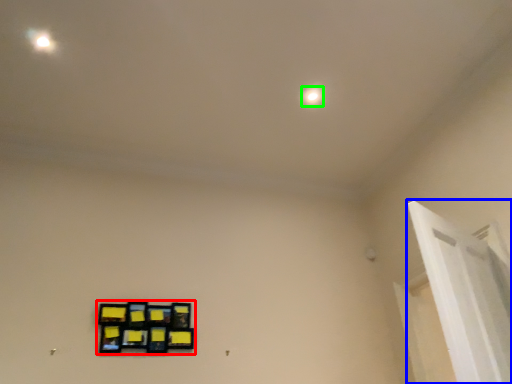
Question: Estimate the real-world distances between objects in this image. Which object is farther from picture frame (highlighted by a red box), window frame (highlighted by a blue box) or dot (highlighted by a green box)?

Choices:
 (A) window frame
 (B) dot

Answer: (B)